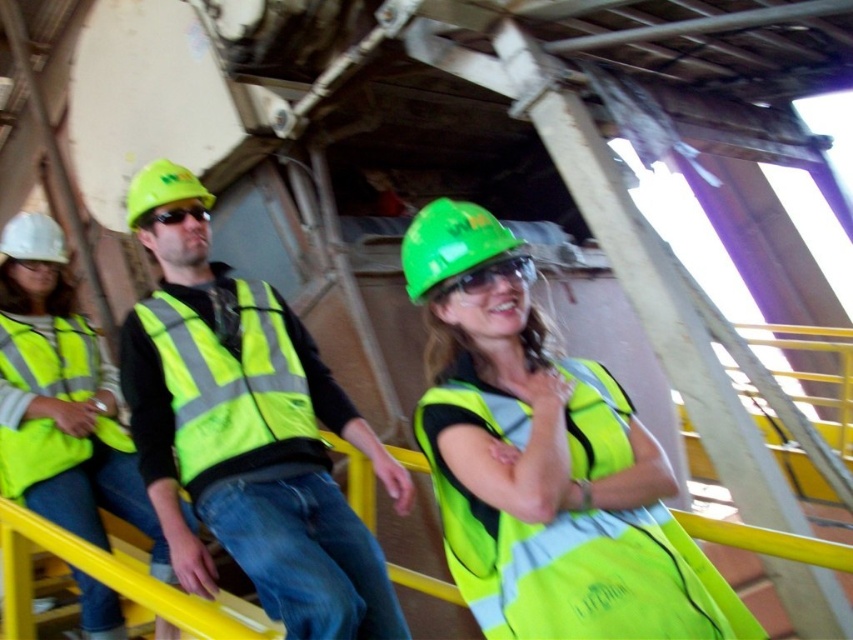
In the scene shown: You are navigating a construction site and need to locate the neon green reflective vest at center. According to the coordinates provided, where exactly is it positioned?

The neon green reflective vest at center is located at point [540,461], which means it is positioned towards the lower right area of the scene based on standard coordinate systems where the origin is the top left corner.